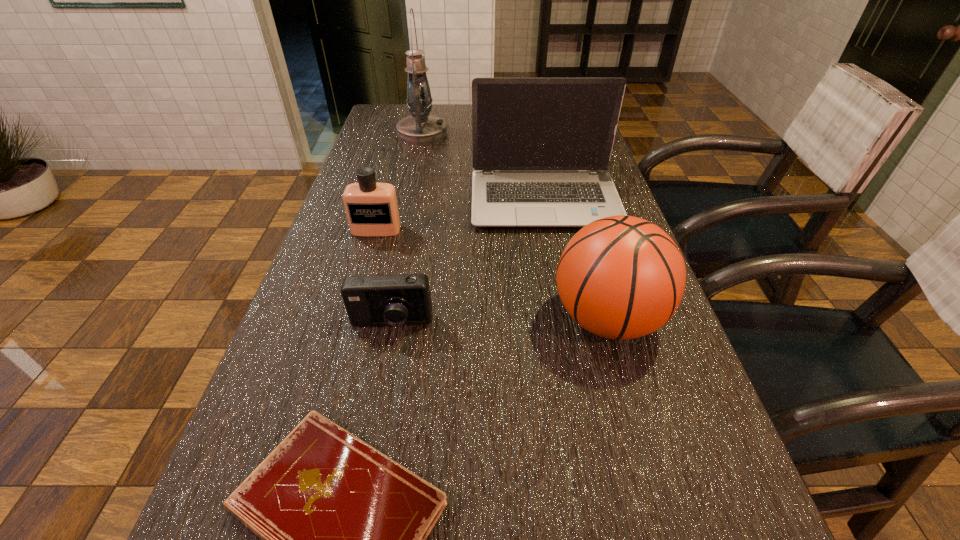
The height and width of the screenshot is (540, 960). What are the coordinates of `free space that satisfies the following two spatial constraints: 1. on the screen of the fifth shortest object; 2. on the left side of the basketball` in the screenshot? It's located at (567, 320).